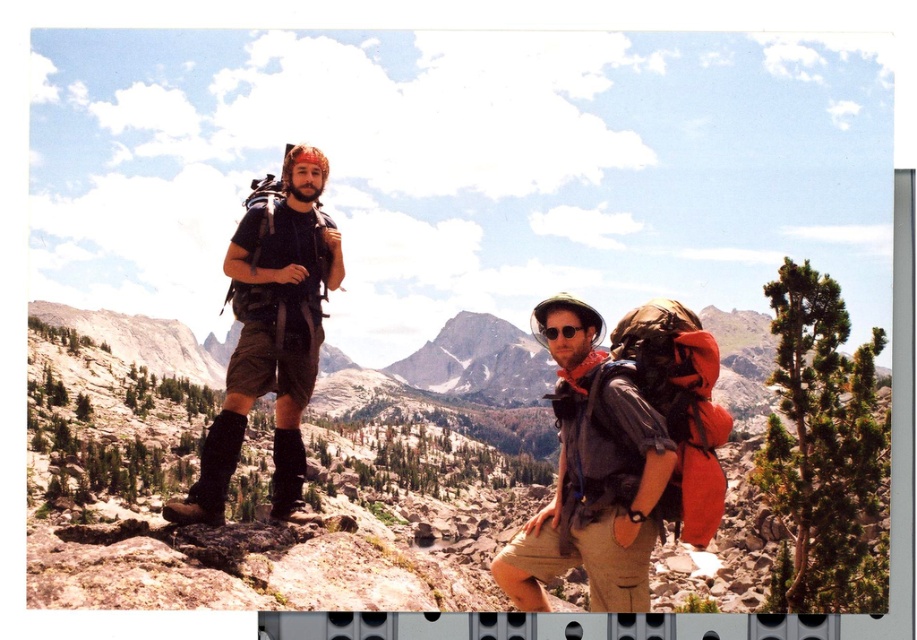
You are standing at the point closer to the viewer between the two points, point (225, 448) and point (566, 326). Which point are you standing at?

You are standing at point (225, 448) because it is closer to the viewer than point (566, 326).